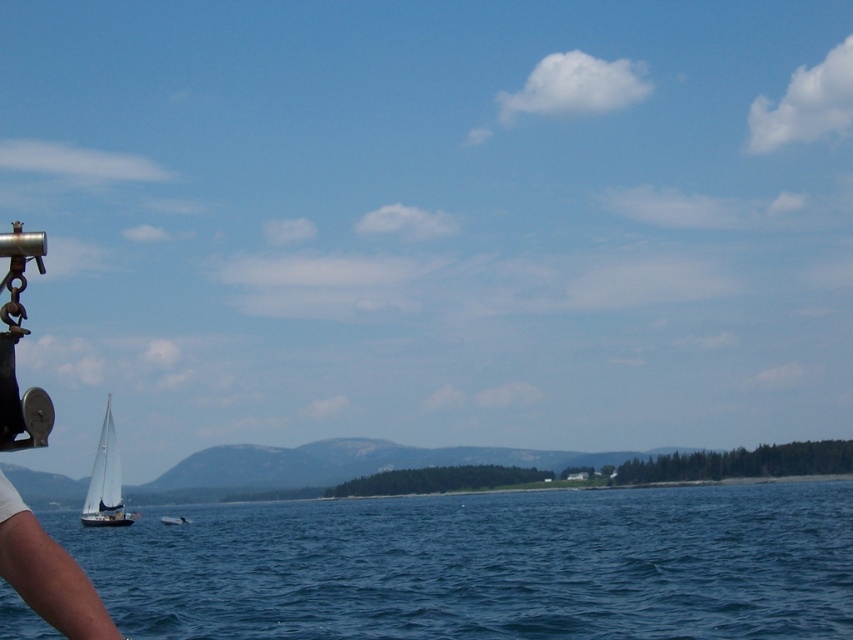
Question: Based on their relative distances, which object is farther from the white fabric arm at lower left?

Choices:
 (A) white glossy boat at center
 (B) white matte sailboat at left

Answer: (A)

Question: Does white matte sailboat at left have a greater width compared to white glossy boat at center?

Choices:
 (A) yes
 (B) no

Answer: (A)

Question: Which point is closer to the camera taking this photo?

Choices:
 (A) (62, 605)
 (B) (181, 627)

Answer: (A)

Question: Which point is farther to the camera?

Choices:
 (A) (171, 518)
 (B) (19, 582)

Answer: (A)

Question: Is the position of blue water at lower center more distant than that of white glossy boat at center?

Choices:
 (A) no
 (B) yes

Answer: (A)

Question: Does blue water at lower center have a larger size compared to white matte sailboat at left?

Choices:
 (A) yes
 (B) no

Answer: (A)